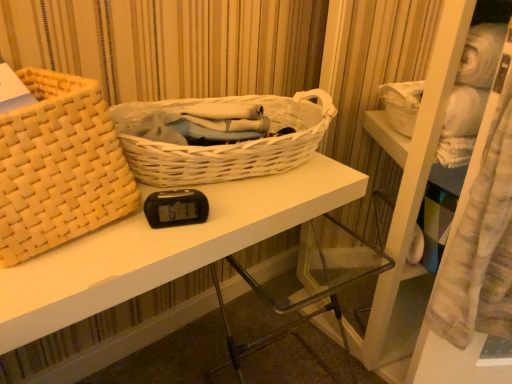
How much space does matte woven picnic basket at left, positioned as the 1th picnic basket in left-to-right order, occupy horizontally?

It is 13.43 inches.

Measure the distance between point (152,155) and camera.

Point (152,155) and camera are 75.00 centimeters apart.

Locate an element on the screen. This screenshot has width=512, height=384. white woven basket at upper left is located at coordinates (163, 248).

Is the surface of white wicker basket at center, acting as the 2th picnic basket starting from the left, in direct contact with matte woven picnic basket at left, positioned as the 1th picnic basket in left-to-right order?

Answer: No, white wicker basket at center, acting as the 2th picnic basket starting from the left, is not touching matte woven picnic basket at left, positioned as the 1th picnic basket in left-to-right order.

Considering the relative sizes of white wicker basket at center, acting as the 2th picnic basket starting from the left, and matte woven picnic basket at left, the 2th picnic basket when ordered from right to left, in the image provided, is white wicker basket at center, acting as the 2th picnic basket starting from the left, shorter than matte woven picnic basket at left, the 2th picnic basket when ordered from right to left,?

Correct, white wicker basket at center, acting as the 2th picnic basket starting from the left, is not as tall as matte woven picnic basket at left, the 2th picnic basket when ordered from right to left.

Where is `picnic basket that is above the matte woven picnic basket at left, positioned as the 1th picnic basket in left-to-right order (from the image's perspective)`? This screenshot has width=512, height=384. picnic basket that is above the matte woven picnic basket at left, positioned as the 1th picnic basket in left-to-right order (from the image's perspective) is located at coordinates (225, 145).

From a real-world perspective, is white wicker basket at center, arranged as the first picnic basket when viewed from the right, on matte woven picnic basket at left, positioned as the 1th picnic basket in left-to-right order?

No, from a real-world perspective, white wicker basket at center, arranged as the first picnic basket when viewed from the right, is not over matte woven picnic basket at left, positioned as the 1th picnic basket in left-to-right order

Where is `picnic basket below the white wicker basket at center, acting as the 2th picnic basket starting from the left (from the image's perspective)`? picnic basket below the white wicker basket at center, acting as the 2th picnic basket starting from the left (from the image's perspective) is located at coordinates (59, 167).

Who is smaller, matte woven picnic basket at left, the 2th picnic basket when ordered from right to left, or white wicker basket at center, acting as the 2th picnic basket starting from the left?

With smaller size is white wicker basket at center, acting as the 2th picnic basket starting from the left.

From the image's perspective, is matte woven picnic basket at left, the 2th picnic basket when ordered from right to left, positioned above or below white wicker basket at center, acting as the 2th picnic basket starting from the left?

Clearly, from the image's perspective, matte woven picnic basket at left, the 2th picnic basket when ordered from right to left, is below white wicker basket at center, acting as the 2th picnic basket starting from the left.

From a real-world perspective, which is physically above, matte woven picnic basket at left, positioned as the 1th picnic basket in left-to-right order, or white wicker basket at center, acting as the 2th picnic basket starting from the left?

matte woven picnic basket at left, positioned as the 1th picnic basket in left-to-right order.

Is white woven basket at upper left not inside white wicker basket at center, arranged as the first picnic basket when viewed from the right?

Yes, white woven basket at upper left is located beyond the bounds of white wicker basket at center, arranged as the first picnic basket when viewed from the right.

Does white woven basket at upper left have a greater height compared to white wicker basket at center, acting as the 2th picnic basket starting from the left?

Yes.

Is white woven basket at upper left wider or thinner than white wicker basket at center, arranged as the first picnic basket when viewed from the right?

In the image, white woven basket at upper left appears to be wider than white wicker basket at center, arranged as the first picnic basket when viewed from the right.

From a real-world perspective, is white woven basket at upper left under white wicker basket at center, acting as the 2th picnic basket starting from the left?

Correct, in the physical world, white woven basket at upper left is lower than white wicker basket at center, acting as the 2th picnic basket starting from the left.

Could you tell me if white woven basket at upper left is turned towards matte woven picnic basket at left, the 2th picnic basket when ordered from right to left?

No, white woven basket at upper left is not aimed at matte woven picnic basket at left, the 2th picnic basket when ordered from right to left.

Is point (66, 298) closer to viewer compared to point (32, 184)?

That is True.

From a real-world perspective, is white woven basket at upper left above or below matte woven picnic basket at left, positioned as the 1th picnic basket in left-to-right order?

In terms of real-world spatial position, white woven basket at upper left is below matte woven picnic basket at left, positioned as the 1th picnic basket in left-to-right order.

Image resolution: width=512 pixels, height=384 pixels. In order to click on desk behind the matte woven picnic basket at left, positioned as the 1th picnic basket in left-to-right order in this screenshot , I will do `click(163, 248)`.

Which of these two, white wicker basket at center, arranged as the first picnic basket when viewed from the right, or white woven basket at upper left, is bigger?

Bigger between the two is white woven basket at upper left.

From the picture: Considering the sizes of objects white wicker basket at center, arranged as the first picnic basket when viewed from the right, and white woven basket at upper left in the image provided, who is taller, white wicker basket at center, arranged as the first picnic basket when viewed from the right, or white woven basket at upper left?

white woven basket at upper left.

Consider the image. From a real-world perspective, does white wicker basket at center, acting as the 2th picnic basket starting from the left, stand above white woven basket at upper left?

Indeed, from a real-world perspective, white wicker basket at center, acting as the 2th picnic basket starting from the left, stands above white woven basket at upper left.

Is white wicker basket at center, arranged as the first picnic basket when viewed from the right, next to white woven basket at upper left and touching it?

They are not placed beside each other.

Can you tell me how much matte woven picnic basket at left, positioned as the 1th picnic basket in left-to-right order, and white woven basket at upper left differ in facing direction?

The angular difference between matte woven picnic basket at left, positioned as the 1th picnic basket in left-to-right order, and white woven basket at upper left is 11.4 degrees.

Can white woven basket at upper left be found inside matte woven picnic basket at left, the 2th picnic basket when ordered from right to left?

No, matte woven picnic basket at left, the 2th picnic basket when ordered from right to left, does not contain white woven basket at upper left.

Is the position of matte woven picnic basket at left, positioned as the 1th picnic basket in left-to-right order, less distant than that of white woven basket at upper left?

Yes, the depth of matte woven picnic basket at left, positioned as the 1th picnic basket in left-to-right order, is less than that of white woven basket at upper left.

Consider the image. Does matte woven picnic basket at left, the 2th picnic basket when ordered from right to left, touch white woven basket at upper left?

matte woven picnic basket at left, the 2th picnic basket when ordered from right to left, and white woven basket at upper left are clearly separated.

Locate an element on the screen. This screenshot has width=512, height=384. picnic basket on the right of matte woven picnic basket at left, positioned as the 1th picnic basket in left-to-right order is located at coordinates (225, 145).

You are a GUI agent. You are given a task and a screenshot of the screen. Output one action in this format:
    pyautogui.click(x=<x>, y=<y>)
    Task: Click on the picnic basket in front of the white wicker basket at center, arranged as the first picnic basket when viewed from the right
    Image resolution: width=512 pixels, height=384 pixels.
    Given the screenshot: What is the action you would take?
    pyautogui.click(x=59, y=167)

Based on the photo, looking at the image, which one is located closer to matte woven picnic basket at left, positioned as the 1th picnic basket in left-to-right order, white wicker basket at center, acting as the 2th picnic basket starting from the left, or white woven basket at upper left?

white woven basket at upper left lies closer to matte woven picnic basket at left, positioned as the 1th picnic basket in left-to-right order, than the other object.

Estimate the real-world distances between objects in this image. Which object is closer to white wicker basket at center, acting as the 2th picnic basket starting from the left, matte woven picnic basket at left, positioned as the 1th picnic basket in left-to-right order, or white woven basket at upper left?

white woven basket at upper left lies closer to white wicker basket at center, acting as the 2th picnic basket starting from the left, than the other object.

From the image, which object appears to be farther from matte woven picnic basket at left, positioned as the 1th picnic basket in left-to-right order, white woven basket at upper left or white wicker basket at center, arranged as the first picnic basket when viewed from the right?

white wicker basket at center, arranged as the first picnic basket when viewed from the right.

When comparing their distances from white wicker basket at center, arranged as the first picnic basket when viewed from the right, does white woven basket at upper left or matte woven picnic basket at left, the 2th picnic basket when ordered from right to left, seem closer?

The object closer to white wicker basket at center, arranged as the first picnic basket when viewed from the right, is white woven basket at upper left.

Looking at the image, which one is located further to white woven basket at upper left, matte woven picnic basket at left, positioned as the 1th picnic basket in left-to-right order, or white wicker basket at center, arranged as the first picnic basket when viewed from the right?

Among the two, matte woven picnic basket at left, positioned as the 1th picnic basket in left-to-right order, is located further to white woven basket at upper left.

Considering their positions, is white wicker basket at center, acting as the 2th picnic basket starting from the left, positioned further to white woven basket at upper left than matte woven picnic basket at left, the 2th picnic basket when ordered from right to left?

matte woven picnic basket at left, the 2th picnic basket when ordered from right to left, is further to white woven basket at upper left.

Identify the location of picnic basket between white wicker basket at center, acting as the 2th picnic basket starting from the left, and white woven basket at upper left vertically. (59, 167).